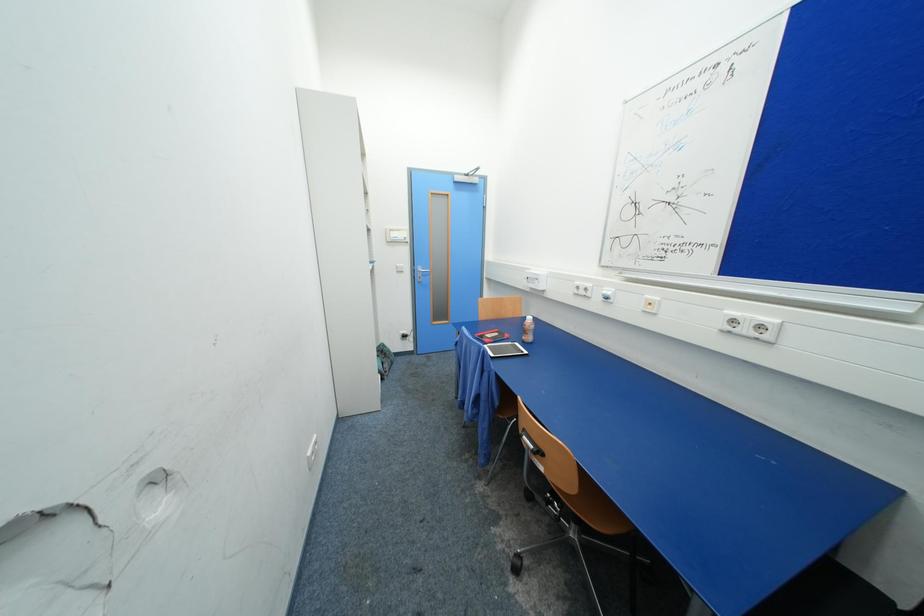
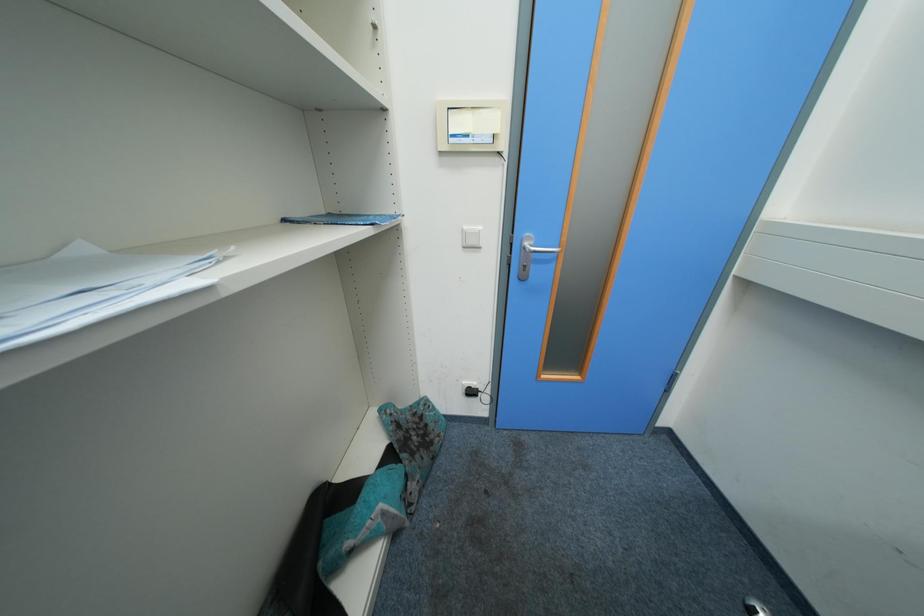
Question: The images are taken continuously from a first-person perspective. In which direction are you moving?

Choices:
 (A) Left
 (B) Right
 (C) Forward
 (D) Backward

Answer: (C)